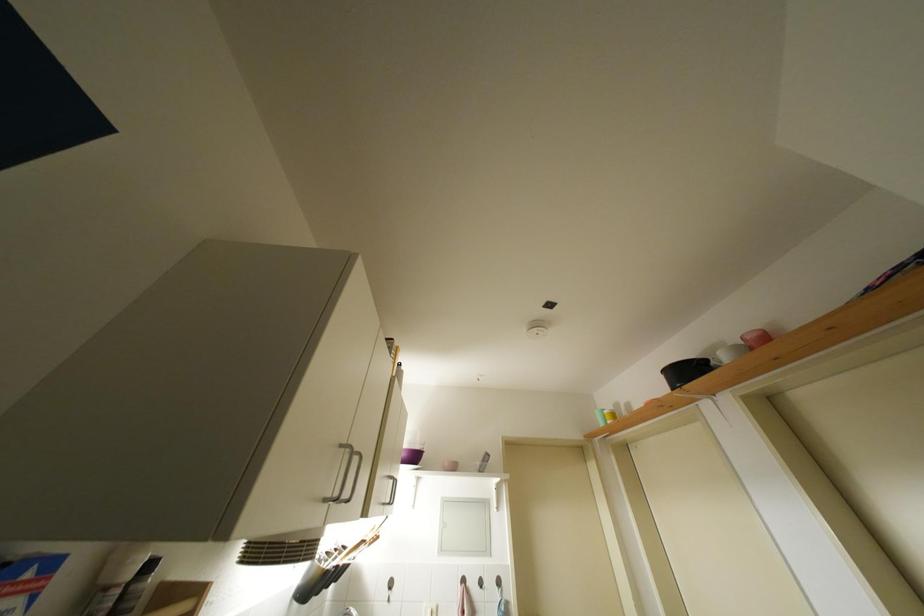
Where would you lift the black pot? Please return your answer as a coordinate pair (x, y).

(686, 371)